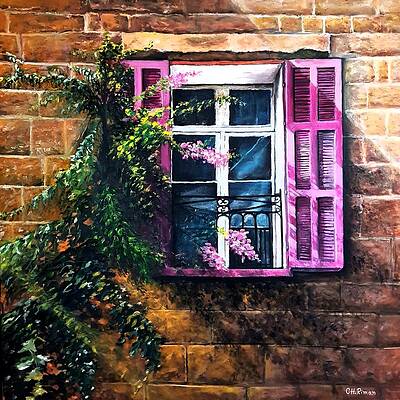
Image resolution: width=400 pixels, height=400 pixels. I want to click on oil painting, so click(x=238, y=312).